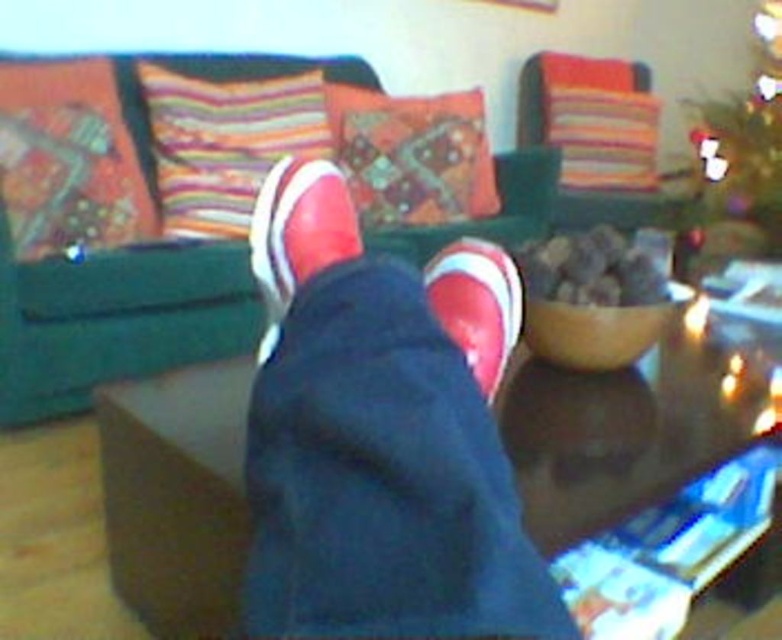
Question: Which point is closer to the camera?

Choices:
 (A) matte white sneaker at center
 (B) green fabric couch at upper center

Answer: (A)

Question: Is green textured christmas tree at upper right bigger than matte white sneaker at center?

Choices:
 (A) yes
 (B) no

Answer: (A)

Question: Which of the following is the closest to the observer?

Choices:
 (A) matte white sneaker at center
 (B) rubberized red sneakers at center
 (C) matte red sneaker at center
 (D) green fabric couch at upper center

Answer: (B)

Question: Is green textured christmas tree at upper right thinner than matte red sneaker at center?

Choices:
 (A) no
 (B) yes

Answer: (A)

Question: Is green fabric couch at upper center thinner than matte red sneaker at center?

Choices:
 (A) no
 (B) yes

Answer: (A)

Question: Which of the following is the closest to the observer?

Choices:
 (A) (259, 237)
 (B) (741, 100)
 (C) (6, 392)
 (D) (246, 461)

Answer: (A)